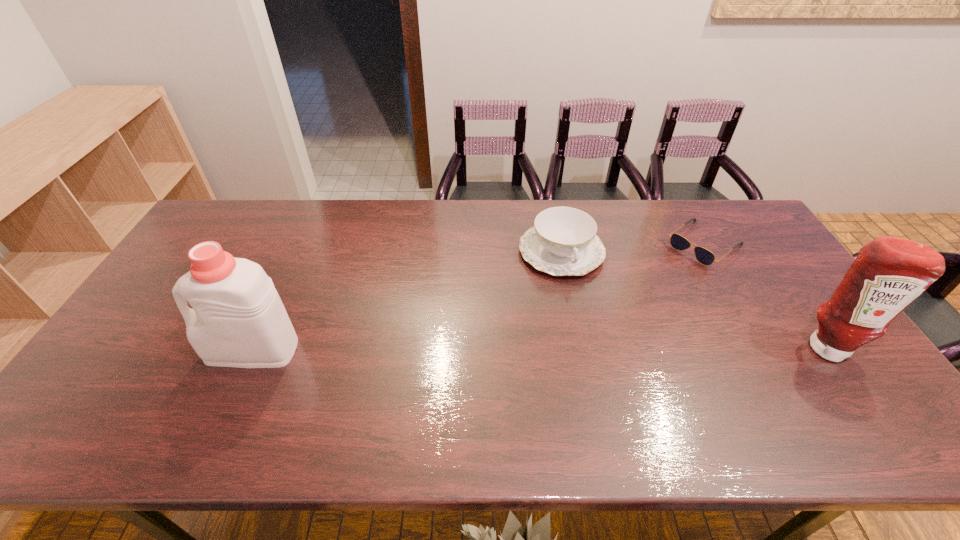
Locate an element on the screen. vacant space on the desktop that is between the leftmost object and the condiment and is positioned on the handle side of the chinaware is located at coordinates (600, 348).

Locate an element on the screen. This screenshot has width=960, height=540. free space on the desktop that is between the leftmost object and the condiment and is positioned on the front-facing side of the shortest object is located at coordinates (572, 348).